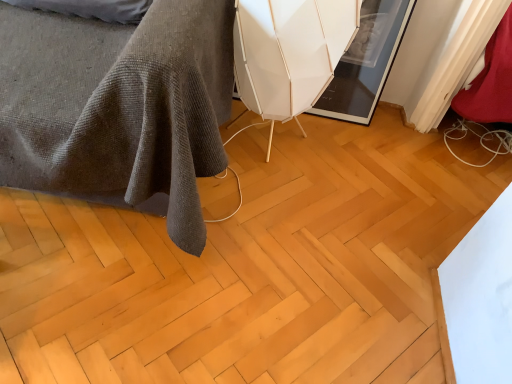
Question: From a real-world perspective, is natural wood floor at center above or below white matte swivel chair at center?

Choices:
 (A) below
 (B) above

Answer: (A)

Question: From the image's perspective, is natural wood floor at center above or below white matte swivel chair at center?

Choices:
 (A) below
 (B) above

Answer: (A)

Question: Estimate the real-world distances between objects in this image. Which object is farther from the natural wood floor at center?

Choices:
 (A) dark gray textured blanket at lower left
 (B) white matte swivel chair at center

Answer: (B)

Question: Based on their relative distances, which object is farther from the natural wood floor at center?

Choices:
 (A) white matte swivel chair at center
 (B) dark gray textured blanket at lower left

Answer: (A)